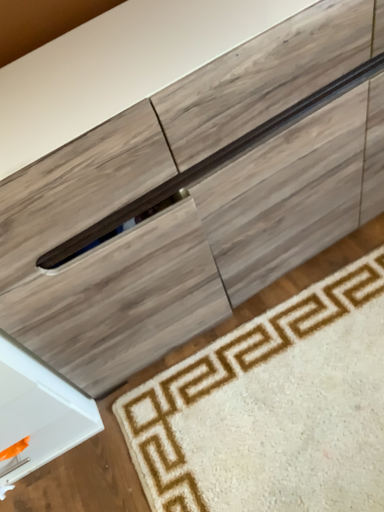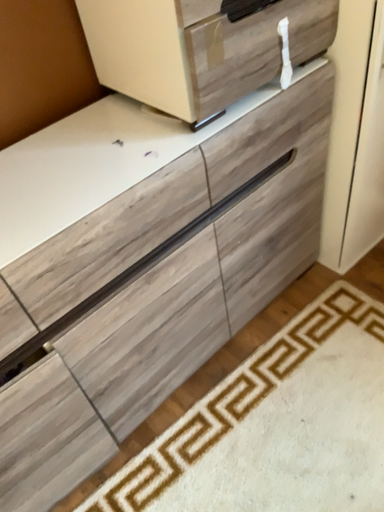
Question: How did the camera likely rotate when shooting the video?

Choices:
 (A) rotated left
 (B) rotated right

Answer: (B)